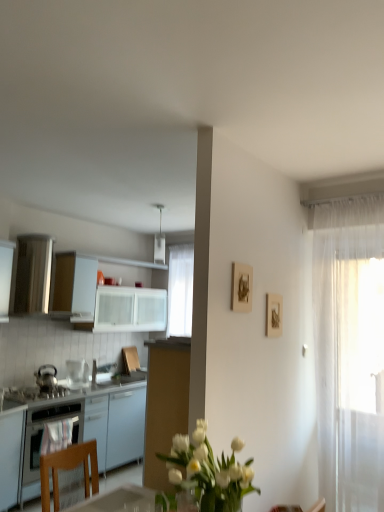
Question: Would you say sheer white curtain at right is to the left or to the right of matte wooden picture frame at upper right, the 2th picture frame when ordered from back to front, in the picture?

Choices:
 (A) left
 (B) right

Answer: (B)

Question: From their relative heights in the image, would you say sheer white curtain at right is taller or shorter than matte wooden picture frame at upper right, the first picture frame in the front-to-back sequence?

Choices:
 (A) short
 (B) tall

Answer: (B)

Question: Based on their relative distances, which object is nearer to the wooden picture frame at upper center, the 1th picture frame viewed from the right?

Choices:
 (A) white glossy cabinet at upper left, positioned as the 1th cabinetry in top-to-bottom order
 (B) white glossy cabinets at left, positioned as the 1th cabinetry in bottom-to-top order
 (C) satin black stove at lower left
 (D) shiny metallic kettle at left, acting as the second kitchen appliance starting from the right
 (E) white plastic light fixture at upper center

Answer: (C)

Question: Which of these objects is positioned farthest from the sheer white curtain at right?

Choices:
 (A) white glossy cabinet at upper left, positioned as the 1th cabinetry in top-to-bottom order
 (B) white glossy microwave at upper left, the first kitchen appliance from the right
 (C) matte wooden picture frame at upper right, which is the 2th picture frame from right to left
 (D) white plastic light fixture at upper center
 (E) satin black stove at lower left

Answer: (B)